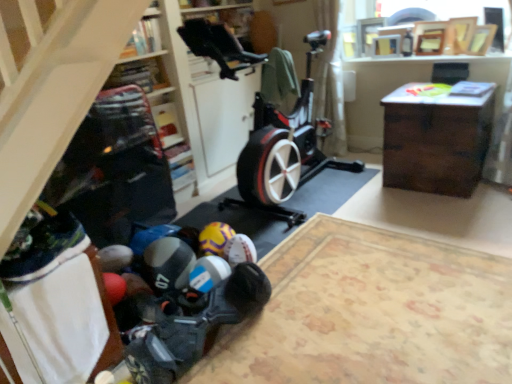
Locate an element on the screen. This screenshot has height=384, width=512. free space above dark wood desk at right (from a real-world perspective) is located at coordinates (435, 92).